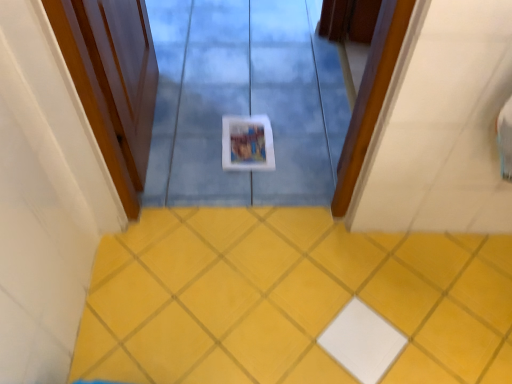
Question: Should I look upward or downward to see wooden door at left?

Choices:
 (A) down
 (B) up

Answer: (B)

Question: Should I look upward or downward to see yellow matte tile at center?

Choices:
 (A) up
 (B) down

Answer: (B)

Question: Is wooden door at left bigger than yellow matte tile at center?

Choices:
 (A) yes
 (B) no

Answer: (A)

Question: Is wooden door at left next to yellow matte tile at center?

Choices:
 (A) yes
 (B) no

Answer: (B)

Question: From the image's perspective, would you say wooden door at left is positioned over yellow matte tile at center?

Choices:
 (A) yes
 (B) no

Answer: (A)

Question: Is wooden door at left further to the viewer compared to yellow matte tile at center?

Choices:
 (A) no
 (B) yes

Answer: (A)

Question: Is wooden door at left thinner than yellow matte tile at center?

Choices:
 (A) no
 (B) yes

Answer: (B)

Question: Could you tell me if wooden door at left is facing yellow matte tile at center?

Choices:
 (A) yes
 (B) no

Answer: (B)

Question: Is yellow matte tile at center bigger than wooden door at left?

Choices:
 (A) no
 (B) yes

Answer: (A)

Question: Considering the relative sizes of yellow matte tile at center and wooden door at left in the image provided, is yellow matte tile at center shorter than wooden door at left?

Choices:
 (A) yes
 (B) no

Answer: (A)

Question: Is yellow matte tile at center positioned with its back to wooden door at left?

Choices:
 (A) yes
 (B) no

Answer: (B)

Question: Does yellow matte tile at center have a smaller size compared to wooden door at left?

Choices:
 (A) yes
 (B) no

Answer: (A)

Question: From a real-world perspective, is yellow matte tile at center on wooden door at left?

Choices:
 (A) yes
 (B) no

Answer: (B)

Question: Can you confirm if yellow matte tile at center is positioned to the right of wooden door at left?

Choices:
 (A) no
 (B) yes

Answer: (B)

Question: Is yellow matte tile at center inside the boundaries of wooden door at left, or outside?

Choices:
 (A) inside
 (B) outside

Answer: (B)